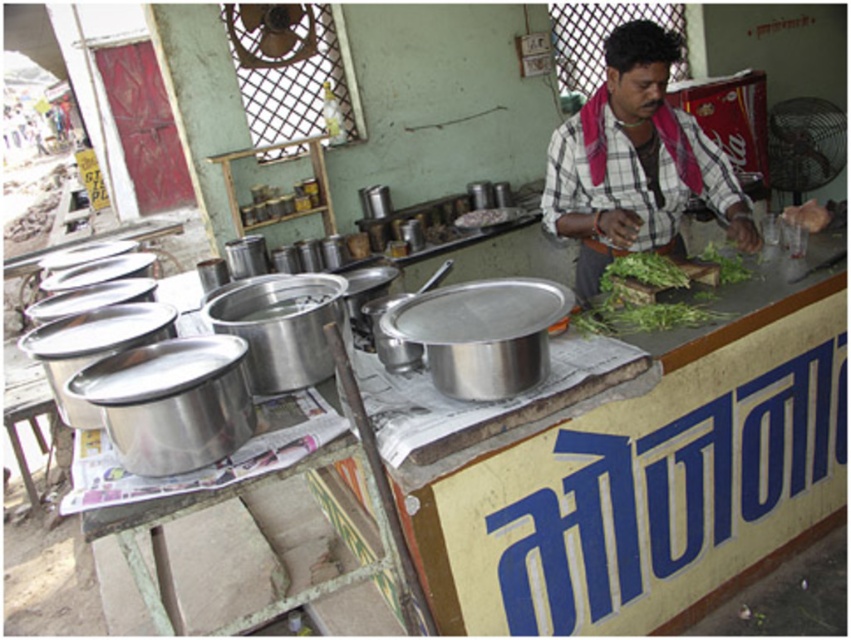
Is white checkered shirt at upper right above green leafy vegetable at center?

Yes.

Looking at this image, how distant is white checkered shirt at upper right from green leafy vegetable at center?

white checkered shirt at upper right and green leafy vegetable at center are 14.96 inches apart from each other.

Is point (637, 150) in front of point (735, 252)?

Yes, point (637, 150) is closer to viewer.

Locate an element on the screen. This screenshot has width=851, height=640. white checkered shirt at upper right is located at coordinates coord(635,163).